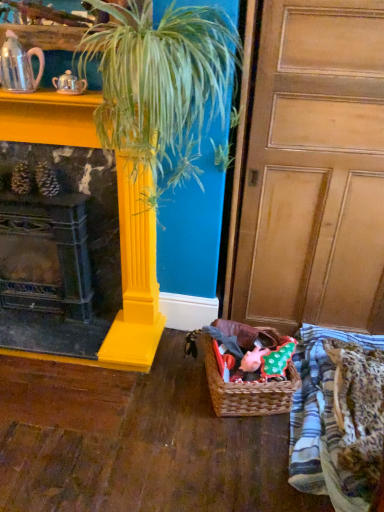
Question: Is pink glossy teapot at upper left, the second tea pot in the left-to-right sequence, not within yellow glossy column at center?

Choices:
 (A) yes
 (B) no

Answer: (A)

Question: Is pink glossy teapot at upper left, the second tea pot in the left-to-right sequence, at the left side of yellow glossy column at center?

Choices:
 (A) no
 (B) yes

Answer: (B)

Question: Is yellow glossy column at center located within pink glossy teapot at upper left, the second tea pot in the left-to-right sequence?

Choices:
 (A) no
 (B) yes

Answer: (A)

Question: From a real-world perspective, is pink glossy teapot at upper left, the first tea pot when ordered from right to left, located higher than yellow glossy column at center?

Choices:
 (A) yes
 (B) no

Answer: (A)

Question: From the image's perspective, is pink glossy teapot at upper left, the second tea pot in the left-to-right sequence, on top of yellow glossy column at center?

Choices:
 (A) yes
 (B) no

Answer: (A)

Question: From a real-world perspective, is wooden at right above or below shiny silver teapot at upper left, the second tea pot viewed from the right?

Choices:
 (A) below
 (B) above

Answer: (A)

Question: In terms of height, does wooden at right look taller or shorter compared to shiny silver teapot at upper left, the second tea pot viewed from the right?

Choices:
 (A) tall
 (B) short

Answer: (A)

Question: Considering the positions of wooden at right and shiny silver teapot at upper left, the second tea pot viewed from the right, in the image, is wooden at right bigger or smaller than shiny silver teapot at upper left, the second tea pot viewed from the right,?

Choices:
 (A) small
 (B) big

Answer: (B)

Question: Would you say wooden at right is to the left or to the right of shiny silver teapot at upper left, the second tea pot viewed from the right, in the picture?

Choices:
 (A) right
 (B) left

Answer: (A)

Question: Is yellow glossy column at center situated inside matte yellow fireplace at left or outside?

Choices:
 (A) inside
 (B) outside

Answer: (B)

Question: From a real-world perspective, relative to matte yellow fireplace at left, is yellow glossy column at center vertically above or below?

Choices:
 (A) below
 (B) above

Answer: (B)

Question: Is point (119, 34) positioned closer to the camera than point (125, 252)?

Choices:
 (A) closer
 (B) farther

Answer: (A)

Question: Looking at the image, does yellow glossy column at center seem bigger or smaller compared to matte yellow fireplace at left?

Choices:
 (A) small
 (B) big

Answer: (B)

Question: Considering the positions of wooden at right and matte yellow fireplace at left in the image, is wooden at right wider or thinner than matte yellow fireplace at left?

Choices:
 (A) thin
 (B) wide

Answer: (B)

Question: From their relative heights in the image, would you say wooden at right is taller or shorter than matte yellow fireplace at left?

Choices:
 (A) tall
 (B) short

Answer: (A)